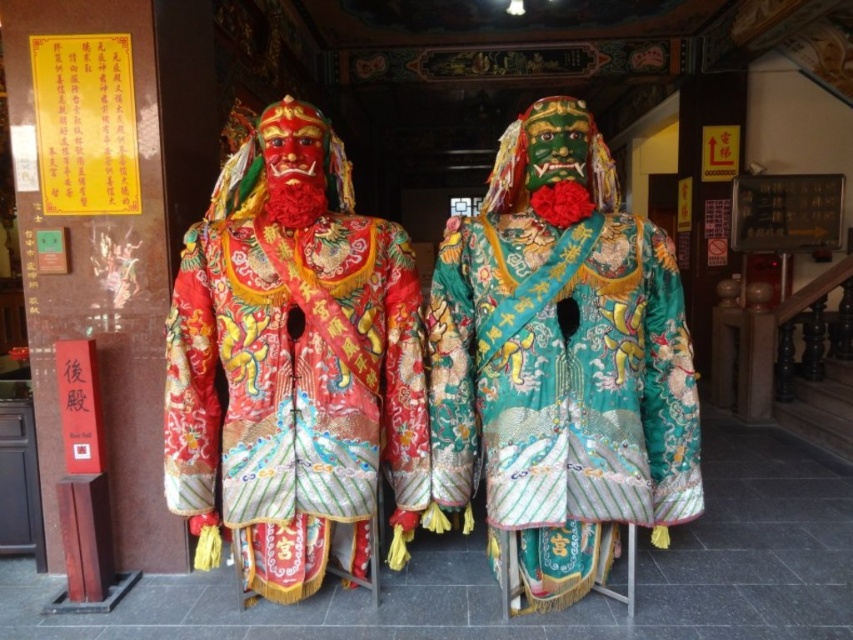
Question: Does shiny silk robe at center come in front of green satin robe at center?

Choices:
 (A) no
 (B) yes

Answer: (B)

Question: Is shiny silk robe at center further to the viewer compared to green satin robe at center?

Choices:
 (A) no
 (B) yes

Answer: (A)

Question: Which point is farther from the camera taking this photo?

Choices:
 (A) (233, 516)
 (B) (567, 404)

Answer: (A)

Question: Can you confirm if shiny silk robe at center is positioned below green satin robe at center?

Choices:
 (A) no
 (B) yes

Answer: (B)